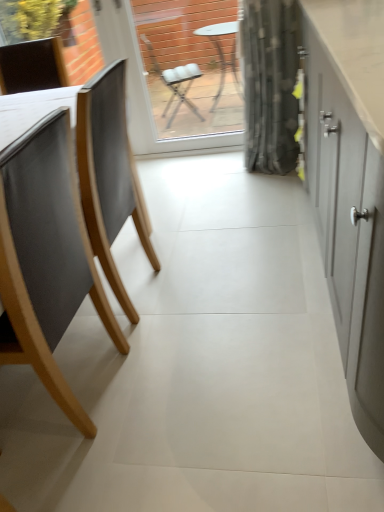
Question: Is transparent glass window screen at center aimed at matte wood chair at left?

Choices:
 (A) no
 (B) yes

Answer: (B)

Question: Is transparent glass window screen at center closer to the viewer compared to matte wood chair at left?

Choices:
 (A) no
 (B) yes

Answer: (A)

Question: Does transparent glass window screen at center have a smaller size compared to matte wood chair at left?

Choices:
 (A) yes
 (B) no

Answer: (A)

Question: Is transparent glass window screen at center to the left of matte wood chair at left from the viewer's perspective?

Choices:
 (A) yes
 (B) no

Answer: (B)

Question: Is transparent glass window screen at center positioned beyond the bounds of matte wood chair at left?

Choices:
 (A) yes
 (B) no

Answer: (A)

Question: Is transparent glass window screen at center behind matte wood chair at left?

Choices:
 (A) no
 (B) yes

Answer: (B)

Question: From the image's perspective, is matte gray cabinet at right below matte wood chair at left?

Choices:
 (A) no
 (B) yes

Answer: (A)

Question: From a real-world perspective, is matte gray cabinet at right below matte wood chair at left?

Choices:
 (A) yes
 (B) no

Answer: (B)

Question: Is matte gray cabinet at right closer to the viewer compared to matte wood chair at left?

Choices:
 (A) no
 (B) yes

Answer: (B)

Question: From the image's perspective, does matte gray cabinet at right appear higher than matte wood chair at left?

Choices:
 (A) yes
 (B) no

Answer: (A)

Question: Are matte gray cabinet at right and matte wood chair at left located far from each other?

Choices:
 (A) yes
 (B) no

Answer: (B)

Question: Considering the relative sizes of matte gray cabinet at right and matte wood chair at left in the image provided, is matte gray cabinet at right shorter than matte wood chair at left?

Choices:
 (A) yes
 (B) no

Answer: (B)

Question: Is matte wood chair at left at the right side of transparent glass window screen at center?

Choices:
 (A) yes
 (B) no

Answer: (B)